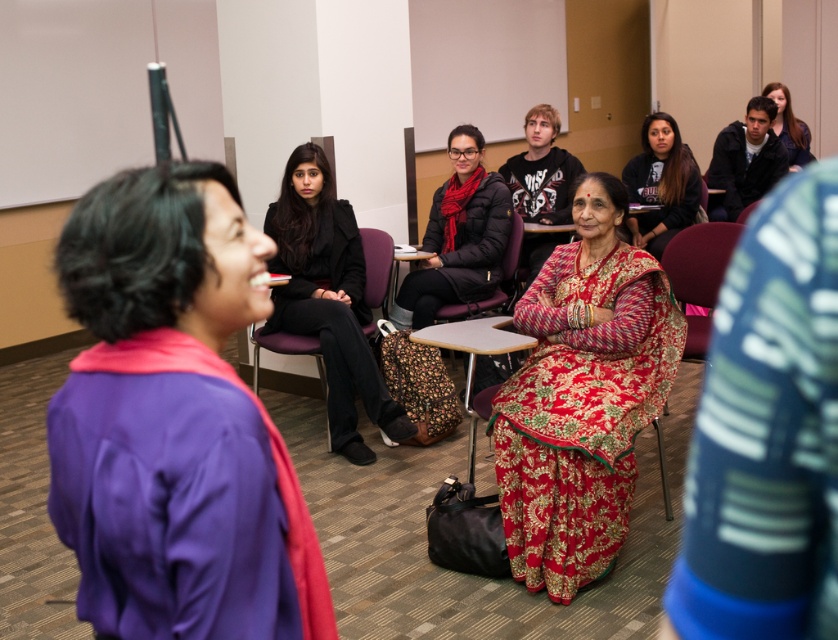
Question: Is red embroidered saree at center behind red floral dress at center?

Choices:
 (A) no
 (B) yes

Answer: (A)

Question: Which point is closer to the camera?

Choices:
 (A) red embroidered saree at center
 (B) red floral fabric chair at center
 (C) red floral dress at center

Answer: (A)

Question: Which point is closer to the camera taking this photo?

Choices:
 (A) (541, 413)
 (B) (681, 262)

Answer: (A)

Question: Is matte black jacket at center above black matte scarf at center?

Choices:
 (A) no
 (B) yes

Answer: (A)

Question: Is red embroidered saree at center smaller than black matte scarf at center?

Choices:
 (A) yes
 (B) no

Answer: (B)

Question: Among these objects, which one is farthest from the camera?

Choices:
 (A) matte black jacket at upper right
 (B) red floral fabric chair at center

Answer: (A)